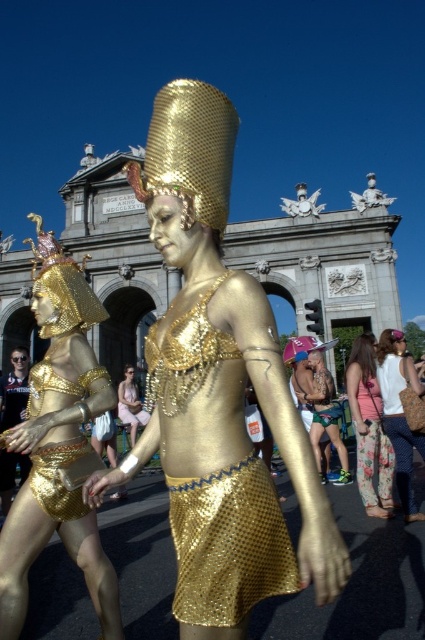
Between gold sequined skirt at lower center and polished stone angel at center, which one appears on the right side from the viewer's perspective?

From the viewer's perspective, polished stone angel at center appears more on the right side.

Does point (51, 449) lie behind point (308, 212)?

No, it is in front of (308, 212).

This screenshot has height=640, width=425. Describe the element at coordinates (62, 474) in the screenshot. I see `gold sequined skirt at lower center` at that location.

Find the location of a particular element. gold sequined skirt at lower center is located at coordinates (62, 474).

Does metallic gold bikini at center have a greater height compared to matte gold fabric dress at center?

No, metallic gold bikini at center is not taller than matte gold fabric dress at center.

Which is above, metallic gold bikini at center or matte gold fabric dress at center?

Positioned higher is metallic gold bikini at center.

Image resolution: width=425 pixels, height=640 pixels. I want to click on metallic gold bikini at center, so click(x=325, y=400).

Find the location of a particular element. This screenshot has width=425, height=640. gold metallic headdress at center is located at coordinates (218, 388).

Is gold metallic headdress at center positioned behind green fabric shorts at center?

That is False.

Is point (268, 372) in front of point (320, 394)?

Yes, point (268, 372) is closer to viewer.

At what (x,y) coordinates should I click in order to perform the action: click on gold metallic headdress at center. Please return your answer as a coordinate pair (x, y). The height and width of the screenshot is (640, 425). Looking at the image, I should click on (218, 388).